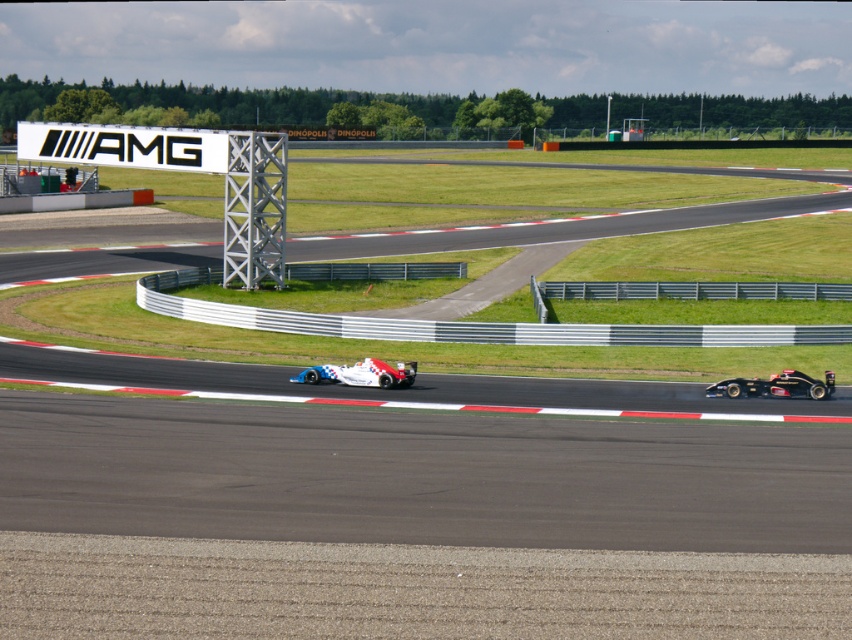
Between black carbon fiber race car at right and white glossy race car at center, which one has less height?

With less height is black carbon fiber race car at right.

Is point (796, 387) in front of point (360, 378)?

That is True.

At what (x,y) coordinates should I click in order to perform the action: click on black carbon fiber race car at right. Please return your answer as a coordinate pair (x, y). The width and height of the screenshot is (852, 640). Looking at the image, I should click on (775, 385).